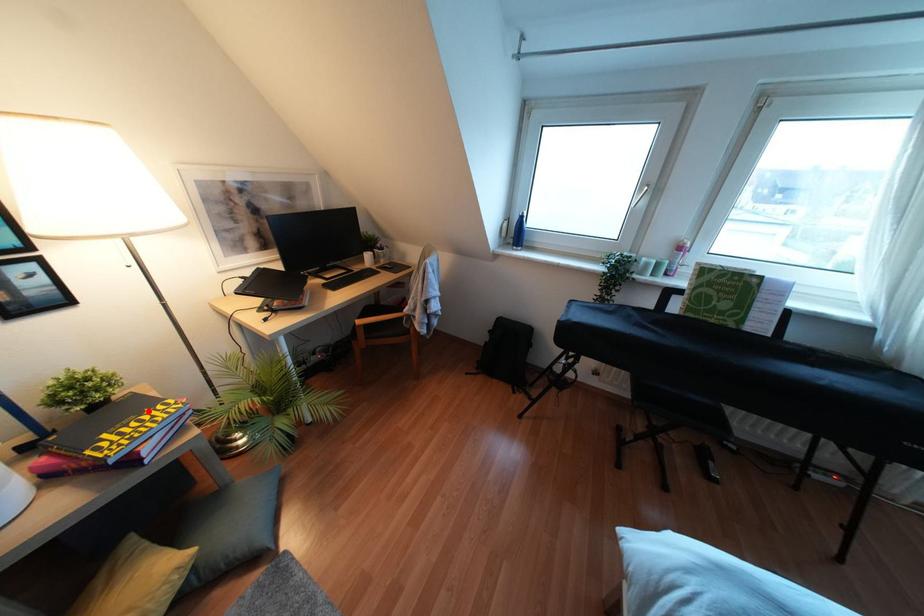
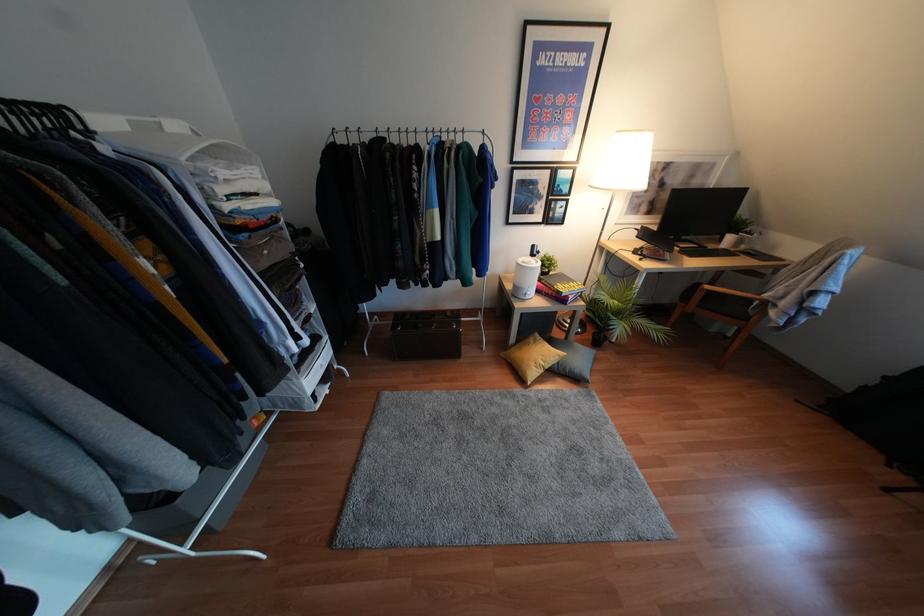
The point at the highlighted location is marked in the first image. Where is the corresponding point in the second image?

(570, 283)